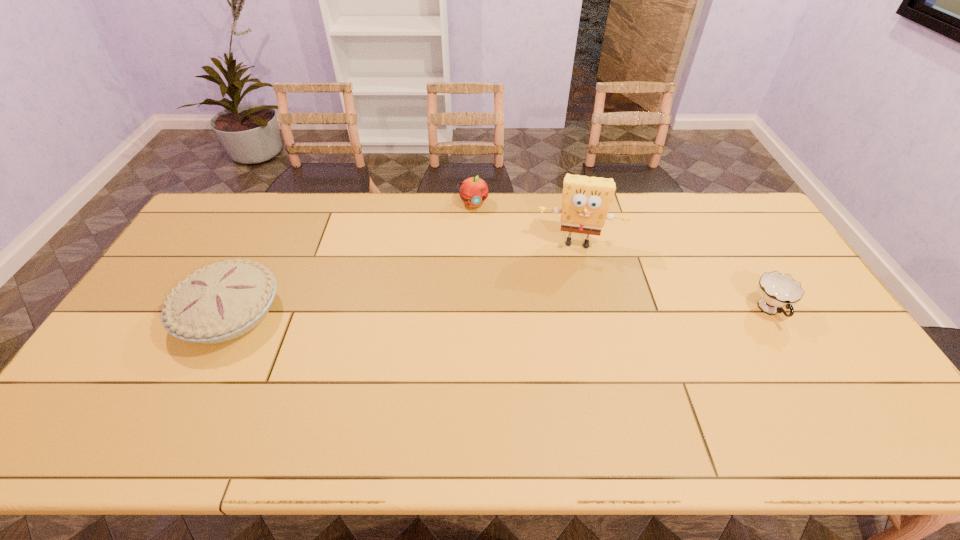
At what (x,y) coordinates should I click in order to perform the action: click on free space on the desktop that is between the leftmost object and the cup and is positioned on the surface of the farthest object. Please return your answer as a coordinate pair (x, y). Looking at the image, I should click on (504, 312).

Image resolution: width=960 pixels, height=540 pixels. What are the coordinates of `free spot on the desktop that is between the leftmost object and the rightmost object and is positioned on the face of the third nearest object` in the screenshot? It's located at (572, 312).